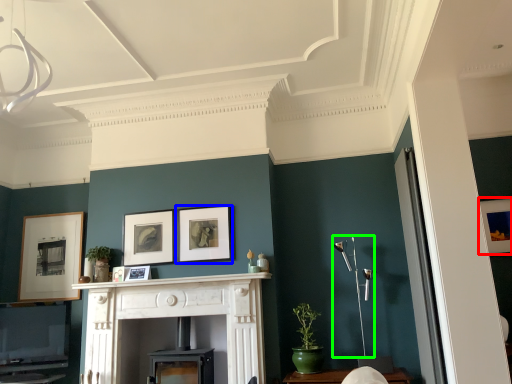
Question: Estimate the real-world distances between objects in this image. Which object is closer to picture frame (highlighted by a red box), picture frame (highlighted by a blue box) or light fixture (highlighted by a green box)?

Choices:
 (A) picture frame
 (B) light fixture

Answer: (B)